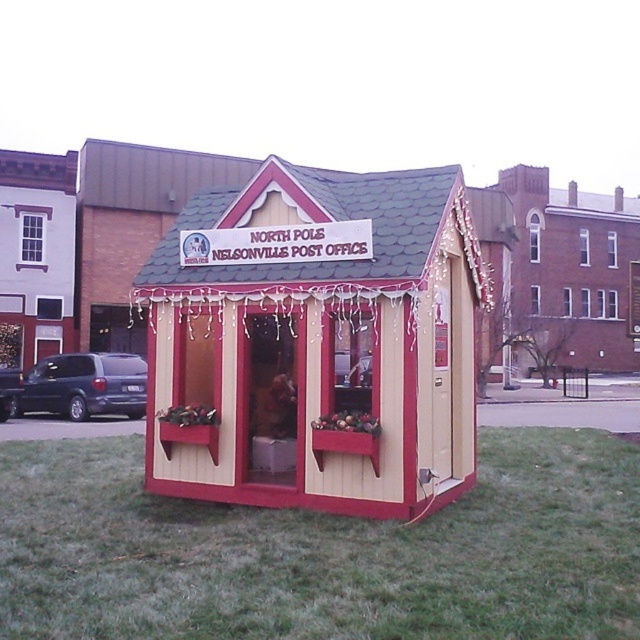
You are a postal worker delivering packages to the North Pole Nelsonville Post Office. You see a brick building at center and a matte white building at upper left. Which building should you go to for the post office, and why?

You should go to the brick building at center because it is the North Pole Nelsonville Post Office as indicated by the sign on its facade, while the matte white building at upper left is smaller and likely not the correct destination.